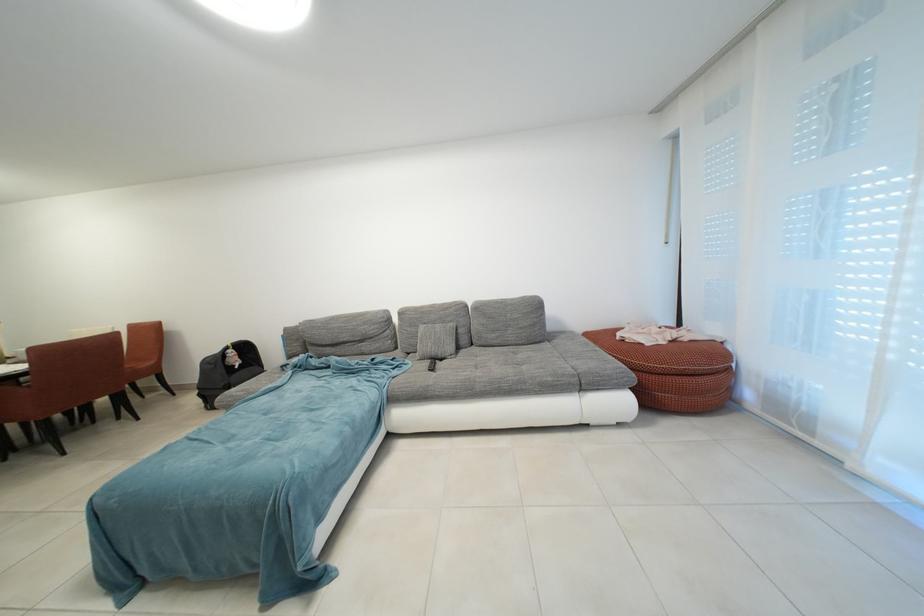
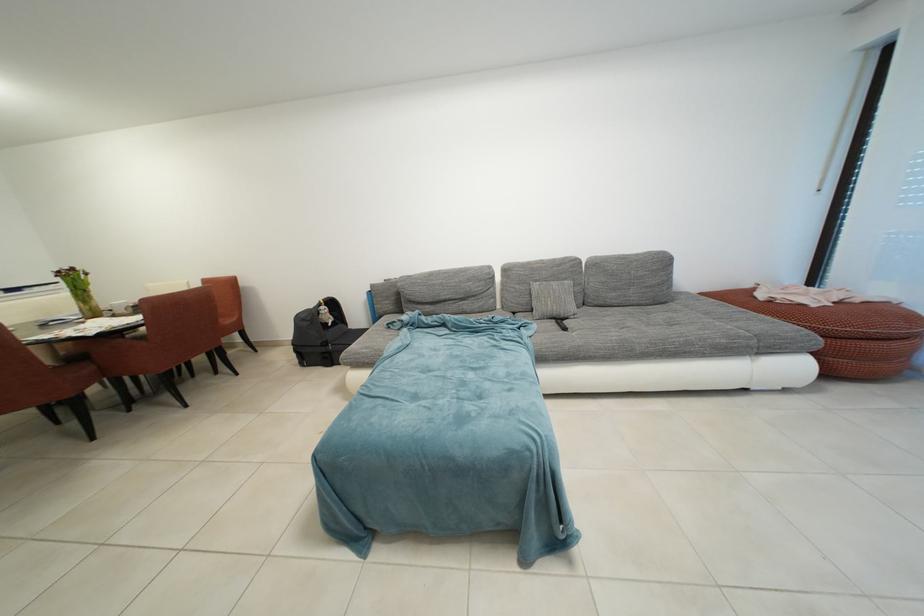
Where in the second image is the point corresponding to (x=236, y=353) from the first image?

(329, 309)